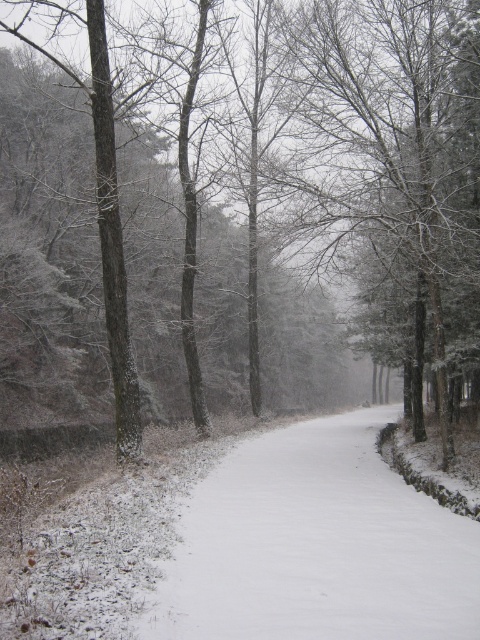
Question: Is white snow-covered tree at center smaller than white snow-covered path at center?

Choices:
 (A) no
 (B) yes

Answer: (A)

Question: Is the position of white snow-covered tree at center more distant than that of white snow-covered path at center?

Choices:
 (A) no
 (B) yes

Answer: (B)

Question: Does white snow-covered tree at center have a smaller size compared to white snow-covered path at center?

Choices:
 (A) no
 (B) yes

Answer: (A)